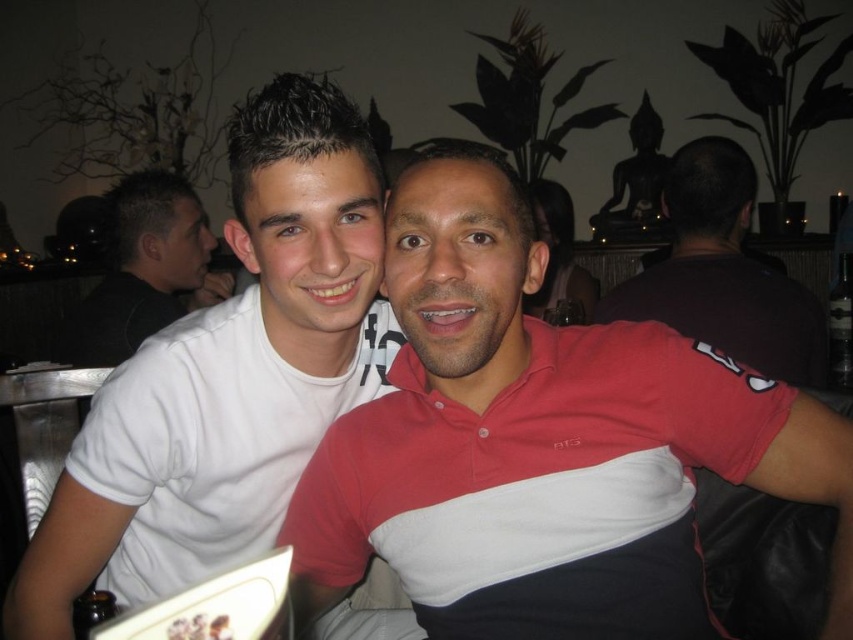
Is white matte t-shirt at left closer to camera compared to dark brown shirt at upper right?

Yes, it is in front of dark brown shirt at upper right.

Who is positioned more to the right, white matte t-shirt at left or dark brown shirt at upper right?

dark brown shirt at upper right

Image resolution: width=853 pixels, height=640 pixels. What do you see at coordinates (228, 374) in the screenshot?
I see `white matte t-shirt at left` at bounding box center [228, 374].

Identify the location of white matte t-shirt at left. (228, 374).

Who is positioned more to the right, matte red and white polo shirt at center or white matte t-shirt at left?

Positioned to the right is matte red and white polo shirt at center.

Can you confirm if matte red and white polo shirt at center is bigger than white matte t-shirt at left?

No.

Is point (646, 602) less distant than point (144, 513)?

That is True.

The height and width of the screenshot is (640, 853). What are the coordinates of `matte red and white polo shirt at center` in the screenshot? It's located at (541, 444).

From the picture: Does matte red and white polo shirt at center appear under dark brown shirt at upper right?

Indeed, matte red and white polo shirt at center is positioned under dark brown shirt at upper right.

Identify the location of matte red and white polo shirt at center. The width and height of the screenshot is (853, 640). (541, 444).